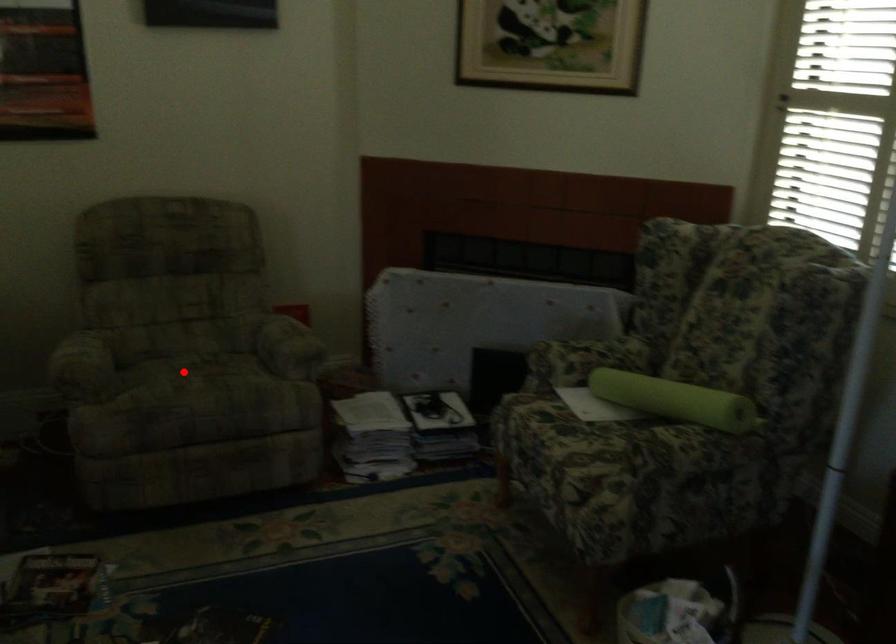
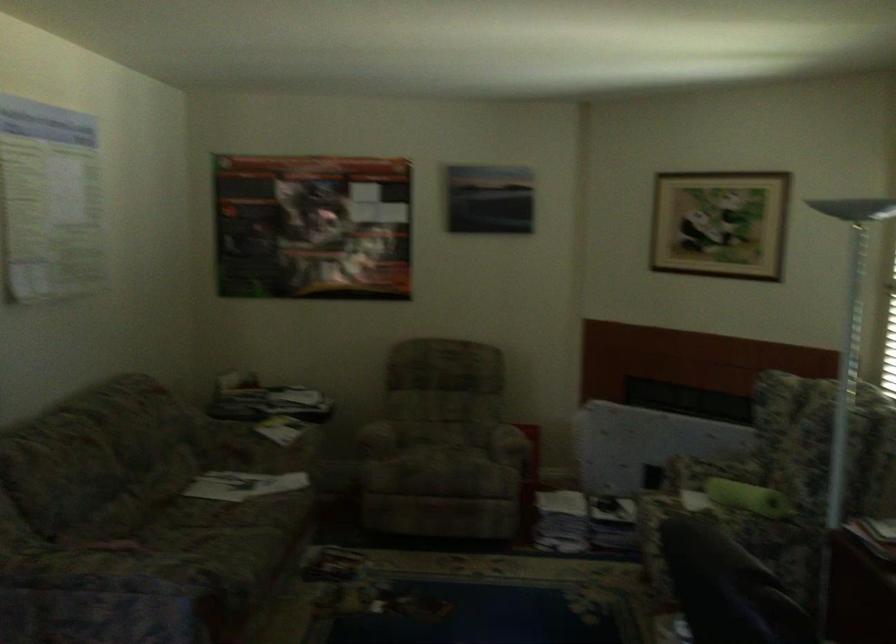
Question: I am providing you with two images of the same scene from different viewpoints. Given a red point in image1, look at the same physical point in image2. Is it:

Choices:
 (A) Closer to the viewpoint
 (B) Farther from the viewpoint

Answer: (B)